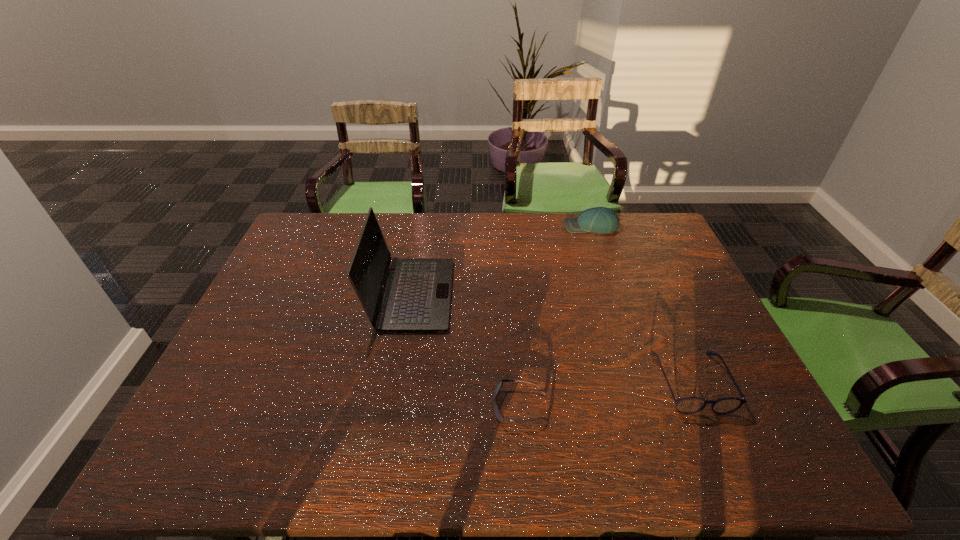
Image resolution: width=960 pixels, height=540 pixels. What are the coordinates of `the tallest object` in the screenshot? It's located at (417, 298).

Locate an element on the screen. laptop computer is located at coordinates (417, 298).

The width and height of the screenshot is (960, 540). I want to click on the farthest object, so (604, 220).

This screenshot has width=960, height=540. I want to click on spectacles, so click(690, 405).

You are a GUI agent. You are given a task and a screenshot of the screen. Output one action in this format:
    pyautogui.click(x=<x>, y=<y>)
    Task: Click on the sunglasses
    The height and width of the screenshot is (540, 960).
    Given the screenshot: What is the action you would take?
    pyautogui.click(x=498, y=414)

In order to click on the second object from left to right in this screenshot , I will do `click(498, 414)`.

Identify the location of vacant position located on the screen of the tallest object. [556, 295].

Locate an element on the screen. vacant space situated on the left of the baseball cap is located at coordinates (450, 227).

Locate an element on the screen. The height and width of the screenshot is (540, 960). free space located on the front-facing side of the second shortest object is located at coordinates (723, 457).

At what (x,y) coordinates should I click in order to perform the action: click on vacant space situated 0.330m on the lenses of the shortest object. Please return your answer as a coordinate pair (x, y). Looking at the image, I should click on (350, 407).